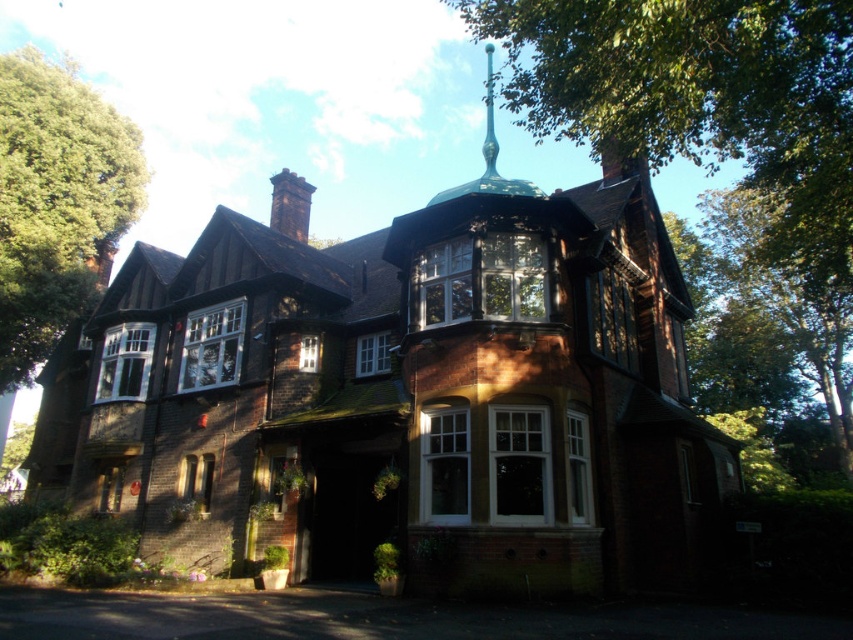
You are standing in front of the house and notice two points marked on the image. One is at coordinate point (x=753, y=198) and the other at point (x=47, y=260). Which point is closer to you?

Point (x=47, y=260) is closer to you because it is less further to the camera than point (x=753, y=198).

You are standing in front of the house and notice two green leafy trees in the upper part of the image. Which tree is closer to the house, the green leafy tree at upper center or the green leafy tree at upper left?

The green leafy tree at upper center is positioned over the green leafy tree at upper left, meaning it is closer to the house.

What are the coordinates of the green leafy tree at upper center in the image?

The green leafy tree at upper center is located at coordinates [718,157].